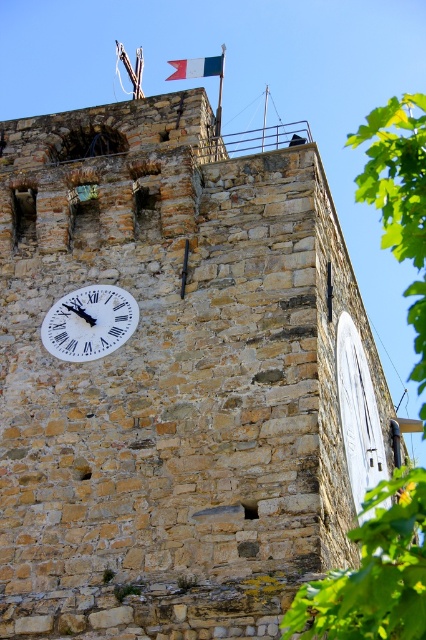
Question: Which object is the farthest from the white matte clock at center-left?

Choices:
 (A) white fabric flag at top center
 (B) green leafy tree at right

Answer: (A)

Question: Can you confirm if green leafy tree at right is wider than white fabric flag at top center?

Choices:
 (A) no
 (B) yes

Answer: (B)

Question: Can you confirm if green leafy tree at right is smaller than white fabric flag at top center?

Choices:
 (A) no
 (B) yes

Answer: (A)

Question: Estimate the real-world distances between objects in this image. Which object is closer to the white fabric flag at top center?

Choices:
 (A) green leafy tree at right
 (B) white matte clock at center-left

Answer: (A)

Question: Estimate the real-world distances between objects in this image. Which object is closer to the white matte clock at center-left?

Choices:
 (A) green leafy tree at right
 (B) white fabric flag at top center

Answer: (A)

Question: Does green leafy tree at right have a smaller size compared to white fabric flag at top center?

Choices:
 (A) yes
 (B) no

Answer: (B)